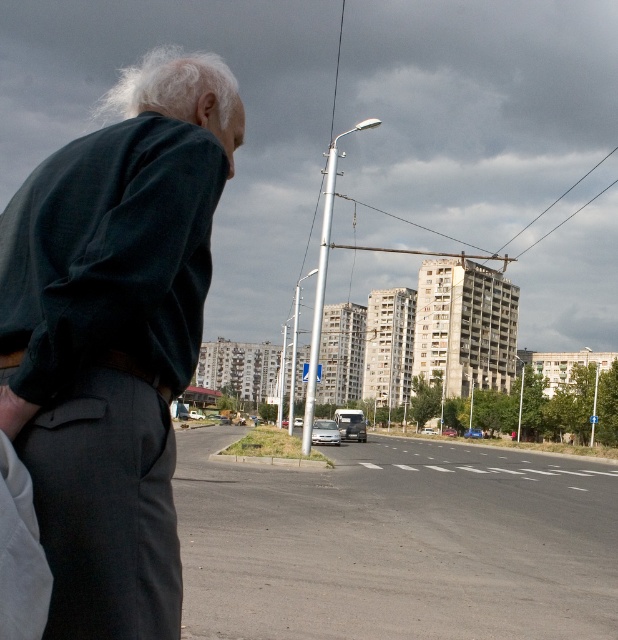
Question: Is dark green fabric jacket at left below brown leather belt at lower left?

Choices:
 (A) yes
 (B) no

Answer: (B)

Question: Does dark green fabric jacket at left have a larger size compared to brown leather belt at lower left?

Choices:
 (A) yes
 (B) no

Answer: (A)

Question: Among these objects, which one is farthest from the camera?

Choices:
 (A) dark green fabric jacket at left
 (B) brown leather belt at lower left

Answer: (A)

Question: Is dark green fabric jacket at left wider than brown leather belt at lower left?

Choices:
 (A) yes
 (B) no

Answer: (A)